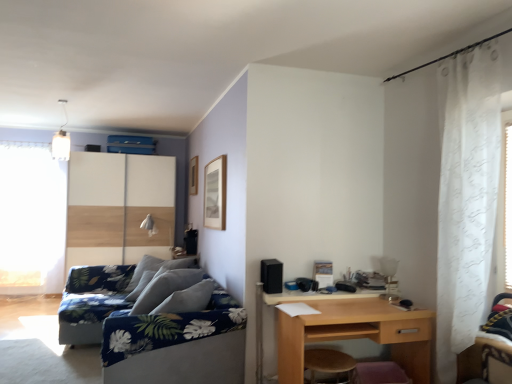
Question: From the image's perspective, is white sheer curtain at left located above or below wooden sliding door at left?

Choices:
 (A) above
 (B) below

Answer: (A)

Question: Is point (26, 190) positioned closer to the camera than point (144, 241)?

Choices:
 (A) closer
 (B) farther

Answer: (A)

Question: Based on their relative distances, which object is farther from the wooden sliding door at left?

Choices:
 (A) blue floral fabric couch at lower left
 (B) light brown wood desk at lower right
 (C) wooden stool at lower center
 (D) white sheer curtain at right
 (E) white sheer curtain at left

Answer: (D)

Question: Estimate the real-world distances between objects in this image. Which object is farther from the wooden sliding door at left?

Choices:
 (A) white sheer curtain at right
 (B) blue floral fabric couch at lower left
 (C) white sheer curtain at left
 (D) light brown wood desk at lower right
 (E) wooden stool at lower center

Answer: (A)